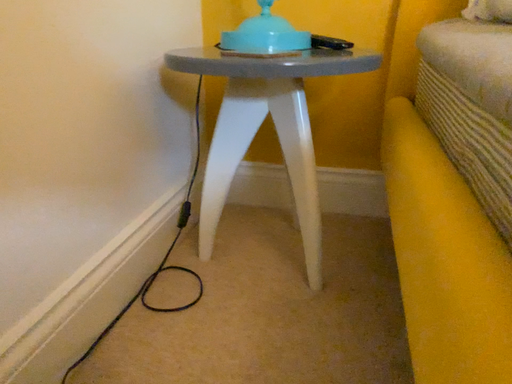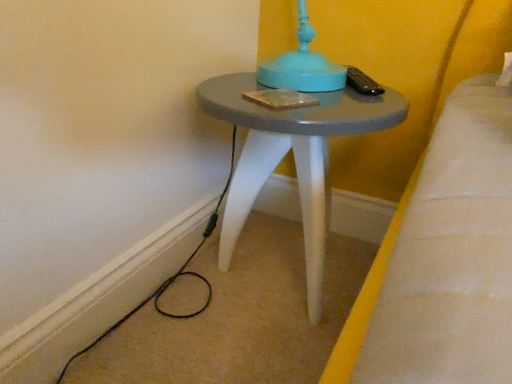
Question: How did the camera likely rotate when shooting the video?

Choices:
 (A) rotated right
 (B) rotated left

Answer: (B)